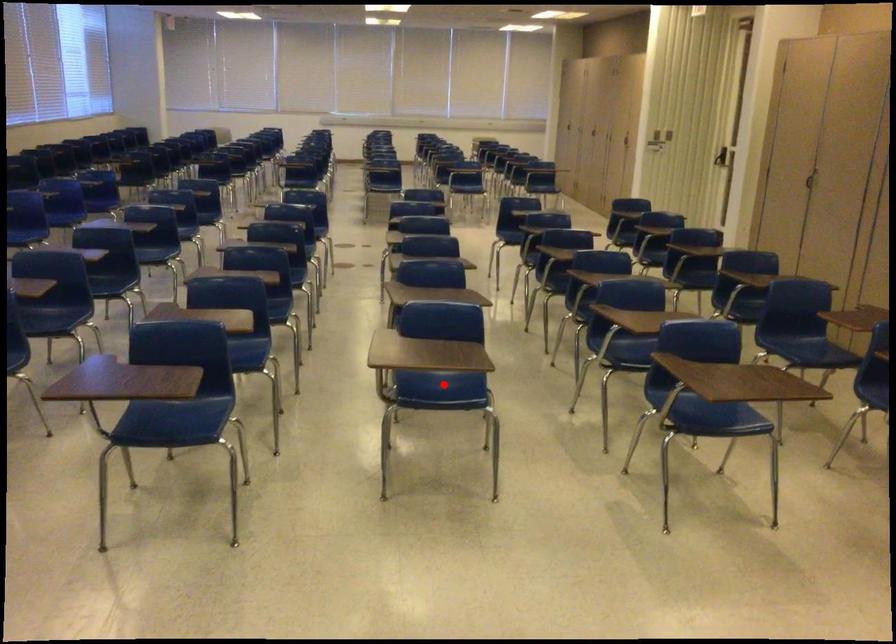
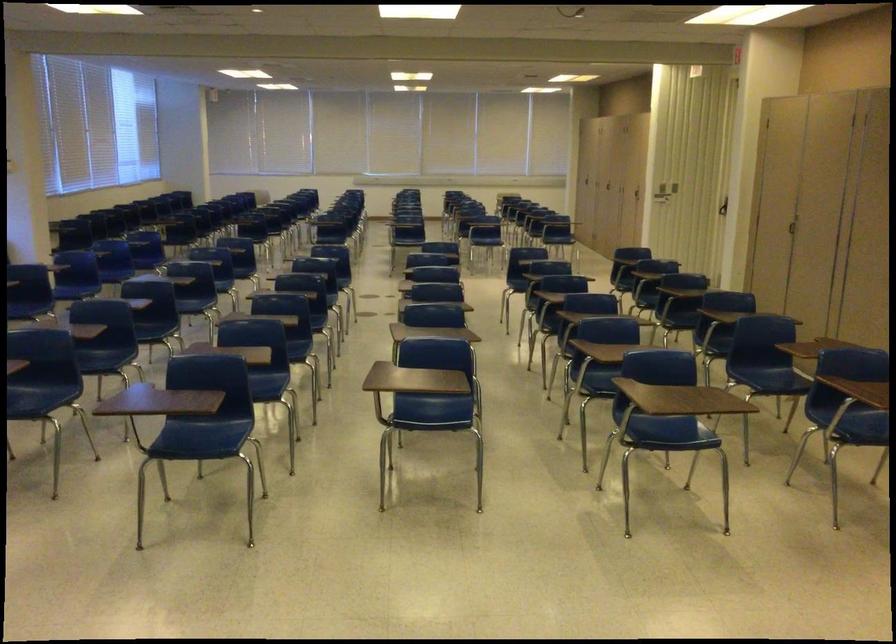
Question: I am providing you with two images of the same scene from different viewpoints. A red point is shown in image1. For the corresponding object point in image2, is it positioned nearer or farther from the camera?

Choices:
 (A) Nearer
 (B) Farther

Answer: (B)